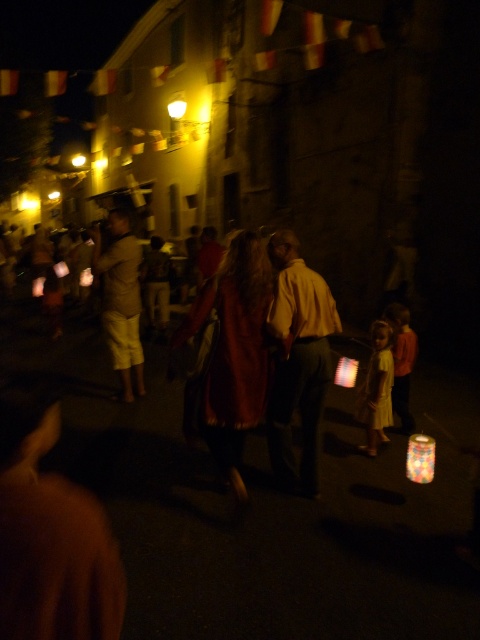
Question: Which object is positioned farthest from the velvet red coat at center?

Choices:
 (A) matte khaki shorts at center
 (B) yellow matte shirt at center

Answer: (A)

Question: Is yellow matte shirt at center smaller than matte khaki shorts at center?

Choices:
 (A) no
 (B) yes

Answer: (B)

Question: From the image, what is the correct spatial relationship of velvet red coat at center in relation to yellow matte shirt at center?

Choices:
 (A) left
 (B) right

Answer: (A)

Question: Which point is closer to the camera?

Choices:
 (A) (259, 353)
 (B) (299, 394)

Answer: (A)

Question: Among these objects, which one is nearest to the camera?

Choices:
 (A) yellow matte shirt at center
 (B) velvet red coat at center
 (C) matte khaki shorts at center

Answer: (B)

Question: Is velvet red coat at center to the right of yellow matte shirt at center from the viewer's perspective?

Choices:
 (A) yes
 (B) no

Answer: (B)